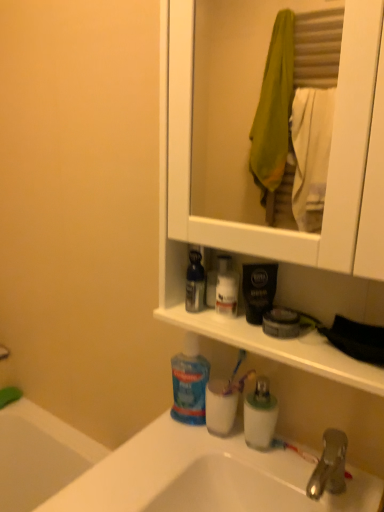
Question: Can you confirm if translucent plastic mouthwash at sink, the 1th mouthwash from the right, is smaller than white glossy lotion at center, the 2th toiletry from the right?

Choices:
 (A) no
 (B) yes

Answer: (A)

Question: From the image's perspective, is translucent plastic mouthwash at sink, the 1th mouthwash from the right, above white glossy lotion at center, which ranks as the first toiletry in top-to-bottom order?

Choices:
 (A) yes
 (B) no

Answer: (B)

Question: Is translucent plastic mouthwash at sink, arranged as the second mouthwash when viewed from the left, at the right side of white glossy lotion at center, the 2th toiletry from the right?

Choices:
 (A) no
 (B) yes

Answer: (B)

Question: Does translucent plastic mouthwash at sink, which is the 1th mouthwash in bottom-to-top order, turn towards white glossy lotion at center, the 2th toiletry from the right?

Choices:
 (A) no
 (B) yes

Answer: (A)

Question: Considering the relative sizes of translucent plastic mouthwash at sink, acting as the 2th mouthwash starting from the top, and white glossy lotion at center, the second toiletry ordered from the bottom, in the image provided, is translucent plastic mouthwash at sink, acting as the 2th mouthwash starting from the top, thinner than white glossy lotion at center, the second toiletry ordered from the bottom,?

Choices:
 (A) yes
 (B) no

Answer: (B)

Question: From a real-world perspective, is white matte cabinet at upper center above or below translucent plastic mouthwash at sink, which is the 1th mouthwash in bottom-to-top order?

Choices:
 (A) below
 (B) above

Answer: (B)

Question: Looking at the image, does white matte cabinet at upper center seem bigger or smaller compared to translucent plastic mouthwash at sink, which is the 1th mouthwash in bottom-to-top order?

Choices:
 (A) big
 (B) small

Answer: (A)

Question: Is white matte cabinet at upper center to the left or to the right of translucent plastic mouthwash at sink, the 1th mouthwash from the right, in the image?

Choices:
 (A) right
 (B) left

Answer: (A)

Question: Does point tap(220, 221) appear closer or farther from the camera than point tap(210, 398)?

Choices:
 (A) closer
 (B) farther

Answer: (A)

Question: Based on their positions, is white matte cabinet at upper center located to the left or right of translucent plastic toothbrush at lower center?

Choices:
 (A) right
 (B) left

Answer: (A)

Question: Is white matte cabinet at upper center inside the boundaries of translucent plastic toothbrush at lower center, or outside?

Choices:
 (A) outside
 (B) inside

Answer: (A)

Question: From their relative heights in the image, would you say white matte cabinet at upper center is taller or shorter than translucent plastic toothbrush at lower center?

Choices:
 (A) tall
 (B) short

Answer: (A)

Question: From the image's perspective, relative to translucent plastic toothbrush at lower center, is white matte cabinet at upper center above or below?

Choices:
 (A) below
 (B) above

Answer: (B)

Question: Considering the relative positions of blue glossy mouthwash at center, acting as the 2th mouthwash starting from the bottom, and white matte cabinet at upper center in the image provided, is blue glossy mouthwash at center, acting as the 2th mouthwash starting from the bottom, to the left or to the right of white matte cabinet at upper center?

Choices:
 (A) right
 (B) left

Answer: (B)

Question: Is blue glossy mouthwash at center, acting as the 2th mouthwash starting from the bottom, wider or thinner than white matte cabinet at upper center?

Choices:
 (A) thin
 (B) wide

Answer: (A)